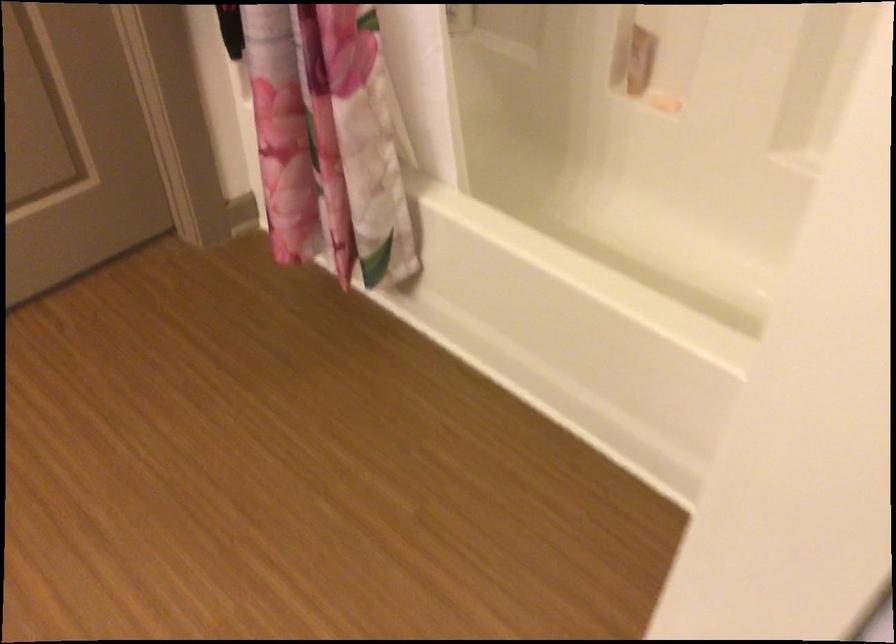
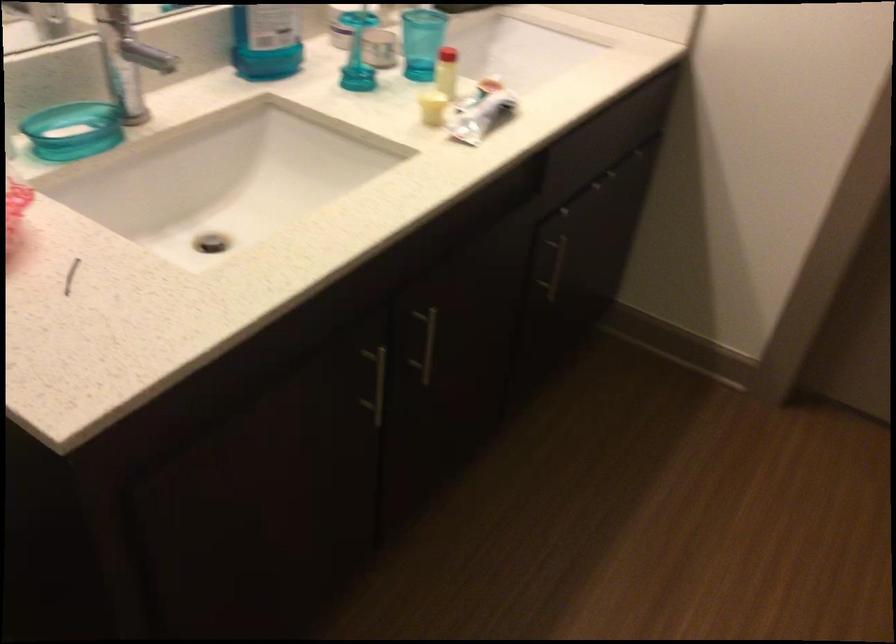
How did the camera likely rotate?

The camera's rotation is toward left-down.